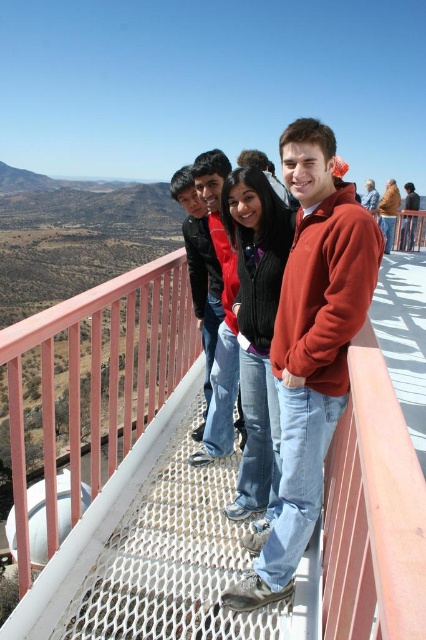
You are standing on the metal mesh walkway with a pink railing, looking at the matte red jacket at center and the matte orange sweater at center. Which clothing item is closer to the ground?

The matte red jacket at center is positioned under the matte orange sweater at center, so the matte red jacket at center is closer to the ground.

You are a tour guide leading a group on the observation deck. You need to ensure that all guests maintain a minimum social distance of 10 feet apart. Given the distance between the matte red jacket at center and the matte orange sweater at center, can they safely stay in their current positions without violating the social distancing guidelines?

The distance between the matte red jacket at center and the matte orange sweater at center is 11.11 meters, which is approximately 36.45 feet. Since the required social distance is 10 feet, they are well within the safe distance and can remain in their current positions.

You are standing on the metal mesh walkway with a pink railing. You need to find the matte red jacket at center. According to the coordinates provided, where exactly is it positioned?

The matte red jacket at center is located at point 0.375 on the x axis and 0.514 on the y axis.